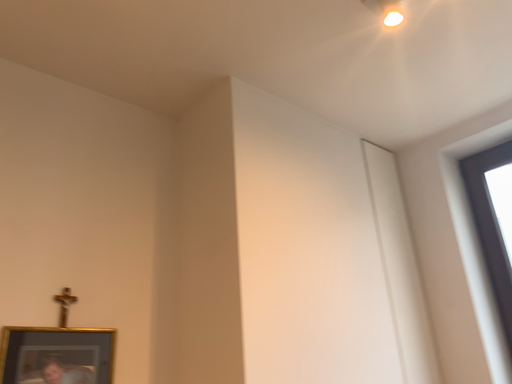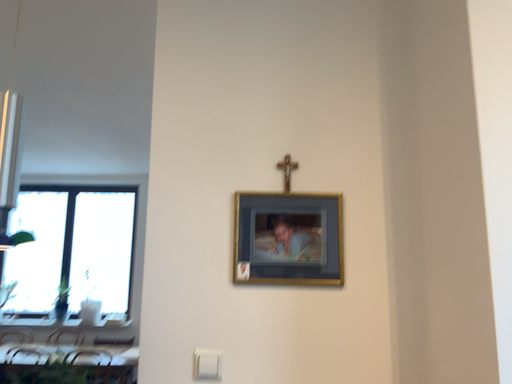
Question: How did the camera likely rotate when shooting the video?

Choices:
 (A) rotated right
 (B) rotated left

Answer: (B)